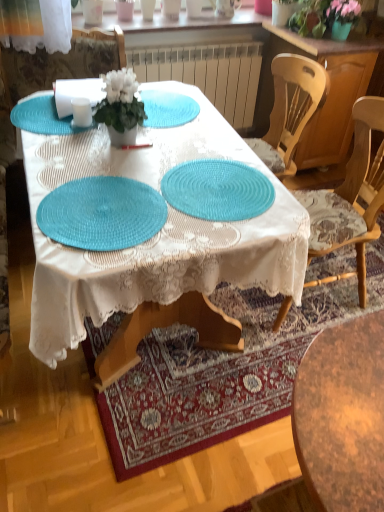
Where is `free space to the left of white matte pot at center`? The image size is (384, 512). free space to the left of white matte pot at center is located at coordinates [72, 139].